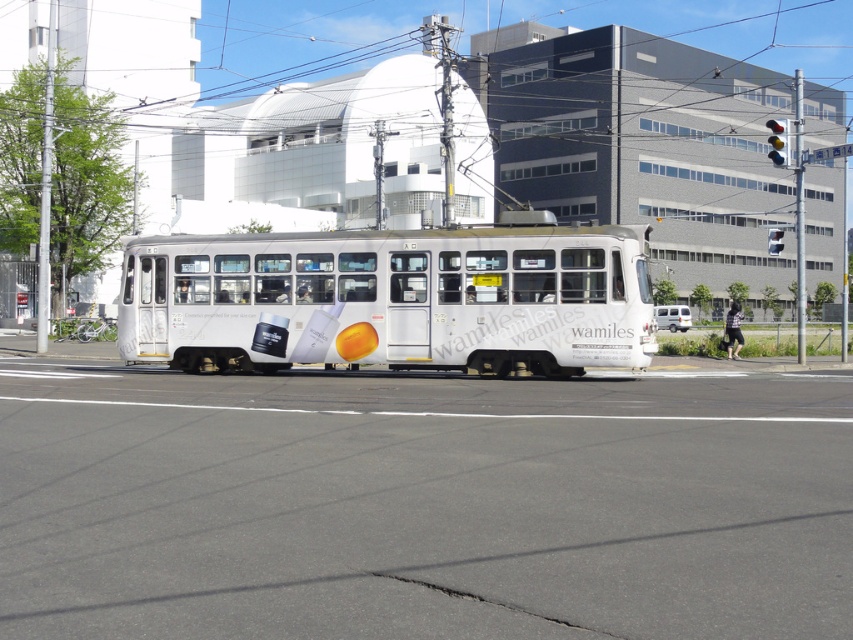
Question: Does white glossy bus at center come in front of white matte van at center?

Choices:
 (A) yes
 (B) no

Answer: (A)

Question: Does white glossy bus at center have a smaller size compared to white matte van at center?

Choices:
 (A) yes
 (B) no

Answer: (A)

Question: Does white glossy bus at center appear on the left side of white matte van at center?

Choices:
 (A) yes
 (B) no

Answer: (A)

Question: Which object appears farthest from the camera in this image?

Choices:
 (A) white matte van at center
 (B) white glossy bus at center

Answer: (A)